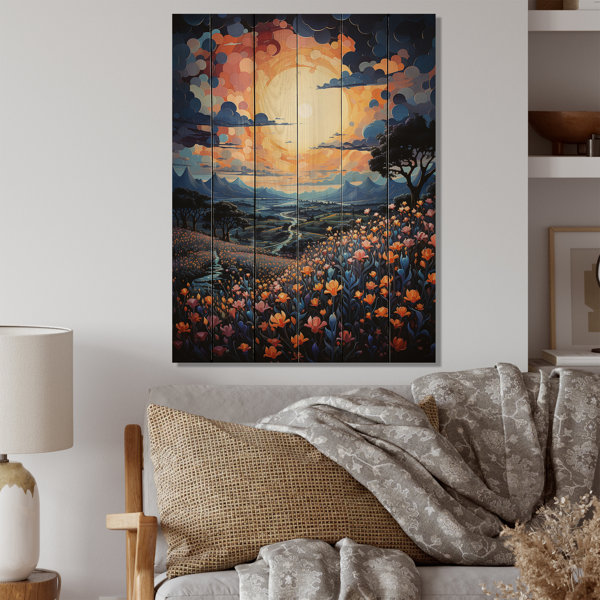
You are a GUI agent. You are given a task and a screenshot of the screen. Output one action in this format:
    pyautogui.click(x=<x>, y=<y>)
    Task: Click on the flowers in painting
    
    Given the screenshot: What is the action you would take?
    pyautogui.click(x=405, y=332), pyautogui.click(x=224, y=330), pyautogui.click(x=318, y=330), pyautogui.click(x=375, y=245)